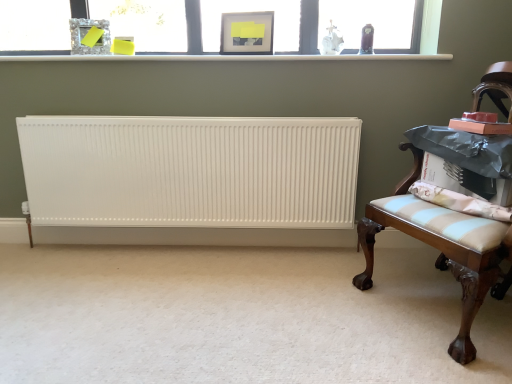
How much space does crystal glass picture frame at upper center, acting as the first picture frame starting from the left, occupy horizontally?

crystal glass picture frame at upper center, acting as the first picture frame starting from the left, is 5.15 inches wide.

Measure the distance between point (77, 49) and camera.

A distance of 7.54 feet exists between point (77, 49) and camera.

This screenshot has width=512, height=384. What do you see at coordinates (238, 317) in the screenshot? I see `white matte radiator at lower left` at bounding box center [238, 317].

This screenshot has width=512, height=384. Describe the element at coordinates (226, 57) in the screenshot. I see `white plastic window sill at upper center` at that location.

Measure the distance between light blue striped cushion at right and camera.

They are 1.57 meters apart.

Image resolution: width=512 pixels, height=384 pixels. What do you see at coordinates (456, 210) in the screenshot?
I see `mahogany wood bench at right` at bounding box center [456, 210].

Image resolution: width=512 pixels, height=384 pixels. I want to click on clear glass window at upper center, so click(x=424, y=36).

Considering the sizes of objects matte glass picture frame at upper center, which is the 1th picture frame in right-to-left order, and light blue striped cushion at right in the image provided, who is thinner, matte glass picture frame at upper center, which is the 1th picture frame in right-to-left order, or light blue striped cushion at right?

With smaller width is matte glass picture frame at upper center, which is the 1th picture frame in right-to-left order.

Based on the photo, does matte glass picture frame at upper center, placed as the second picture frame when sorted from left to right, have a smaller size compared to light blue striped cushion at right?

Yes.

Can you confirm if matte glass picture frame at upper center, which is the 1th picture frame in right-to-left order, is shorter than light blue striped cushion at right?

In fact, matte glass picture frame at upper center, which is the 1th picture frame in right-to-left order, may be taller than light blue striped cushion at right.

Is matte glass picture frame at upper center, placed as the second picture frame when sorted from left to right, located outside light blue striped cushion at right?

matte glass picture frame at upper center, placed as the second picture frame when sorted from left to right, is positioned outside light blue striped cushion at right.

How different are the orientations of clear glass window at upper center and mahogany wood bench at right in degrees?

The angular difference between clear glass window at upper center and mahogany wood bench at right is 60.3 degrees.

From their relative heights in the image, would you say clear glass window at upper center is taller or shorter than mahogany wood bench at right?

Clearly, clear glass window at upper center is shorter compared to mahogany wood bench at right.

Considering the positions of objects clear glass window at upper center and mahogany wood bench at right in the image provided, who is more to the left, clear glass window at upper center or mahogany wood bench at right?

clear glass window at upper center.

Which point is more distant from viewer, (x=429, y=40) or (x=408, y=216)?

Positioned behind is point (x=429, y=40).

Image resolution: width=512 pixels, height=384 pixels. I want to click on plain located underneath the white plastic window sill at upper center (from a real-world perspective), so (238, 317).

Is white plastic window sill at upper center wider than white matte radiator at lower left?

No.

Could you measure the distance between white plastic window sill at upper center and white matte radiator at lower left?

white plastic window sill at upper center and white matte radiator at lower left are 1.25 meters apart.

Looking at this image, from a real-world perspective, who is located lower, white plastic window sill at upper center or white matte radiator at lower left?

white matte radiator at lower left, from a real-world perspective.

This screenshot has height=384, width=512. Identify the location of picture frame that is below the matte glass picture frame at upper center, which is the 1th picture frame in right-to-left order (from the image's perspective). (86, 34).

Which object is further away from the camera, crystal glass picture frame at upper center, marked as the second picture frame in a right-to-left arrangement, or matte glass picture frame at upper center, placed as the second picture frame when sorted from left to right?

crystal glass picture frame at upper center, marked as the second picture frame in a right-to-left arrangement, is more distant.

Can we say crystal glass picture frame at upper center, marked as the second picture frame in a right-to-left arrangement, lies outside matte glass picture frame at upper center, which is the 1th picture frame in right-to-left order?

crystal glass picture frame at upper center, marked as the second picture frame in a right-to-left arrangement, lies outside matte glass picture frame at upper center, which is the 1th picture frame in right-to-left order,'s area.

Does point (95, 20) lie behind point (249, 51)?

Yes, it is behind point (249, 51).

In the image, is crystal glass picture frame at upper center, acting as the first picture frame starting from the left, positioned in front of or behind white ribbed radiator at center?

crystal glass picture frame at upper center, acting as the first picture frame starting from the left, is behind white ribbed radiator at center.

In terms of size, does crystal glass picture frame at upper center, acting as the first picture frame starting from the left, appear bigger or smaller than white ribbed radiator at center?

Considering their sizes, crystal glass picture frame at upper center, acting as the first picture frame starting from the left, takes up less space than white ribbed radiator at center.

From the image's perspective, is crystal glass picture frame at upper center, acting as the first picture frame starting from the left, positioned above or below white ribbed radiator at center?

From the image's perspective, crystal glass picture frame at upper center, acting as the first picture frame starting from the left, appears above white ribbed radiator at center.

Considering the sizes of crystal glass picture frame at upper center, marked as the second picture frame in a right-to-left arrangement, and white ribbed radiator at center in the image, is crystal glass picture frame at upper center, marked as the second picture frame in a right-to-left arrangement, taller or shorter than white ribbed radiator at center?

crystal glass picture frame at upper center, marked as the second picture frame in a right-to-left arrangement, is shorter than white ribbed radiator at center.

Does white ribbed radiator at center lie behind white matte radiator at lower left?

A: Yes, it is behind white matte radiator at lower left.

Between white ribbed radiator at center and white matte radiator at lower left, which one has less height?

white matte radiator at lower left is shorter.

How much distance is there between white ribbed radiator at center and white matte radiator at lower left?

white ribbed radiator at center is 55.98 centimeters from white matte radiator at lower left.

Identify the location of plain lying in front of the white ribbed radiator at center. (238, 317).

Considering the sizes of objects matte glass picture frame at upper center, which is the 1th picture frame in right-to-left order, and white ribbed radiator at center in the image provided, who is thinner, matte glass picture frame at upper center, which is the 1th picture frame in right-to-left order, or white ribbed radiator at center?

matte glass picture frame at upper center, which is the 1th picture frame in right-to-left order, is thinner.

Consider the image. Can you confirm if matte glass picture frame at upper center, placed as the second picture frame when sorted from left to right, is positioned to the left of white ribbed radiator at center?

No.

Considering the relative sizes of matte glass picture frame at upper center, placed as the second picture frame when sorted from left to right, and white ribbed radiator at center in the image provided, is matte glass picture frame at upper center, placed as the second picture frame when sorted from left to right, smaller than white ribbed radiator at center?

Yes.

You are a GUI agent. You are given a task and a screenshot of the screen. Output one action in this format:
    pyautogui.click(x=<x>, y=<y>)
    Task: Click on the 2nd picture frame above the light blue striped cushion at right (from the image's perspective)
    This screenshot has height=384, width=512.
    Given the screenshot: What is the action you would take?
    pyautogui.click(x=247, y=33)

This screenshot has height=384, width=512. Find the location of `window located above the mahogany wood bench at right (from a real-world perspective)`. window located above the mahogany wood bench at right (from a real-world perspective) is located at coordinates (424, 36).

Estimate the real-world distances between objects in this image. Which object is further from clear glass window at upper center, white plastic window sill at upper center or white ribbed radiator at center?

The object further to clear glass window at upper center is white ribbed radiator at center.

From the image, which object appears to be nearer to clear glass window at upper center, matte glass picture frame at upper center, which is the 1th picture frame in right-to-left order, or crystal glass picture frame at upper center, marked as the second picture frame in a right-to-left arrangement?

matte glass picture frame at upper center, which is the 1th picture frame in right-to-left order, lies closer to clear glass window at upper center than the other object.

Based on their spatial positions, is matte glass picture frame at upper center, which is the 1th picture frame in right-to-left order, or white ribbed radiator at center closer to light blue striped cushion at right?

Among the two, white ribbed radiator at center is located nearer to light blue striped cushion at right.

Looking at the image, which one is located further to light blue striped cushion at right, white matte radiator at lower left or mahogany wood bench at right?

white matte radiator at lower left lies further to light blue striped cushion at right than the other object.

Based on the photo, looking at the image, which one is located further to white plastic window sill at upper center, matte glass picture frame at upper center, which is the 1th picture frame in right-to-left order, or crystal glass picture frame at upper center, marked as the second picture frame in a right-to-left arrangement?

The object further to white plastic window sill at upper center is crystal glass picture frame at upper center, marked as the second picture frame in a right-to-left arrangement.

Which object lies further to the anchor point white matte radiator at lower left, mahogany wood bench at right or light blue striped cushion at right?

light blue striped cushion at right lies further to white matte radiator at lower left than the other object.

Which object lies nearer to the anchor point white ribbed radiator at center, mahogany wood bench at right or white matte radiator at lower left?

The object closer to white ribbed radiator at center is white matte radiator at lower left.

Estimate the real-world distances between objects in this image. Which object is further from matte glass picture frame at upper center, placed as the second picture frame when sorted from left to right, light blue striped cushion at right or crystal glass picture frame at upper center, marked as the second picture frame in a right-to-left arrangement?

light blue striped cushion at right is further to matte glass picture frame at upper center, placed as the second picture frame when sorted from left to right.

Identify the location of window sill between clear glass window at upper center and white matte radiator at lower left from top to bottom. The width and height of the screenshot is (512, 384). point(226,57).

Where is `window between crystal glass picture frame at upper center, marked as the second picture frame in a right-to-left arrangement, and white plastic window sill at upper center`? The image size is (512, 384). window between crystal glass picture frame at upper center, marked as the second picture frame in a right-to-left arrangement, and white plastic window sill at upper center is located at coordinates (424, 36).

Image resolution: width=512 pixels, height=384 pixels. In order to click on window sill between crystal glass picture frame at upper center, marked as the second picture frame in a right-to-left arrangement, and matte glass picture frame at upper center, placed as the second picture frame when sorted from left to right, from left to right in this screenshot , I will do `click(226, 57)`.

I want to click on window sill located between crystal glass picture frame at upper center, marked as the second picture frame in a right-to-left arrangement, and mahogany wood bench at right in the left-right direction, so tap(226, 57).